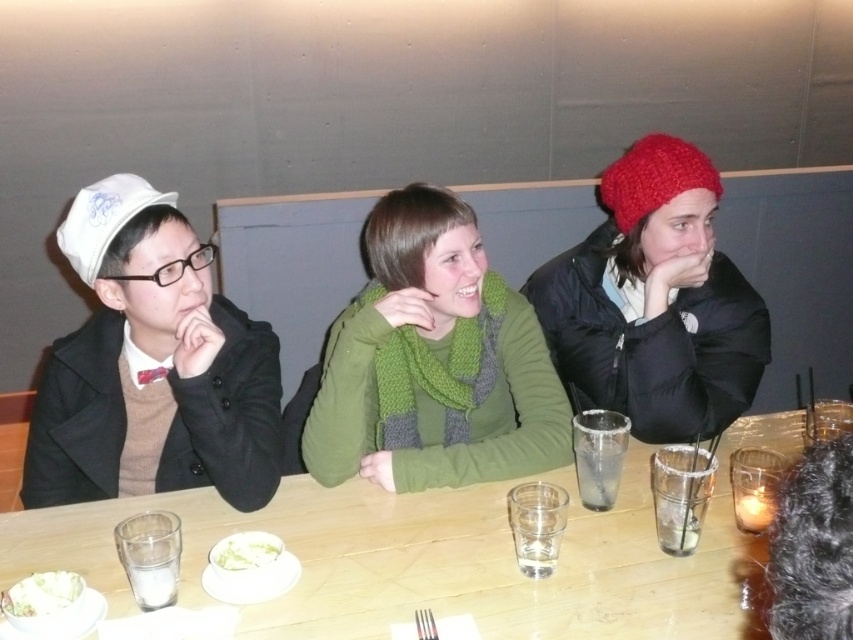
You are a delivery person standing at the entrance of the restaurant. You need to place a small package on the table between the white matte hat at left and the green scarf in the center. The package requires a minimum of 1 meter of space between it and any other objects. Can you safely place the package there?

The distance between the white matte hat at left and the green scarf in the center is 1.24 meters. Since the required minimum space is 1 meter, the package can be safely placed there as the available space exceeds the required distance.

You are a photographer standing at the back of the restaurant. You want to take a photo of both the knitted red beanie at right and the knitted red beanie at upper right in the same frame. Can you position yourself so that both are visible without moving the subjects?

Answer: The knitted red beanie at right is 7.71 inches from the knitted red beanie at upper right. Since the distance between them is relatively small, positioning yourself at an angle where both can be captured within the camera frame should be possible without moving the subjects.